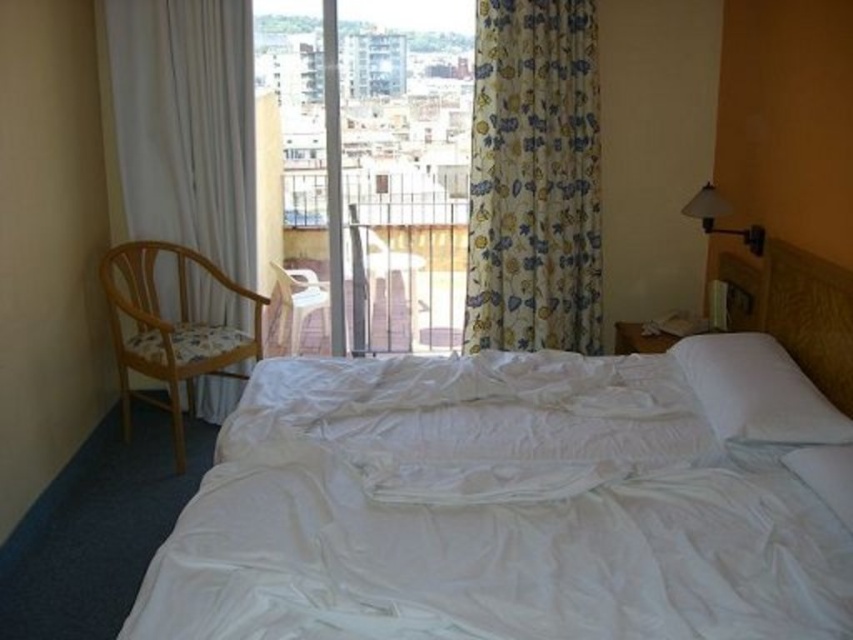
Can you confirm if transparent glass door at center is positioned to the left of wooden textured armchair at left?

In fact, transparent glass door at center is to the right of wooden textured armchair at left.

Which is behind, point (399, 307) or point (200, 369)?

The point (399, 307) is behind.

Does point (428, 26) come behind point (128, 296)?

Yes, point (428, 26) is farther from viewer.

Locate an element on the screen. This screenshot has height=640, width=853. transparent glass door at center is located at coordinates [404, 168].

Between point (552, 330) and point (741, 420), which one is positioned in front?

Point (741, 420) is more forward.

Which is behind, point (491, 157) or point (770, 419)?

Positioned behind is point (491, 157).

At what (x,y) coordinates should I click in order to perform the action: click on floral fabric curtain at upper center. Please return your answer as a coordinate pair (x, y). Looking at the image, I should click on (532, 179).

Which is in front, point (375, 172) or point (202, 410)?

Point (202, 410) is more forward.

Does point (375, 36) lie behind point (144, 225)?

That is True.

The width and height of the screenshot is (853, 640). What are the coordinates of `transparent glass door at center` in the screenshot? It's located at (404, 168).